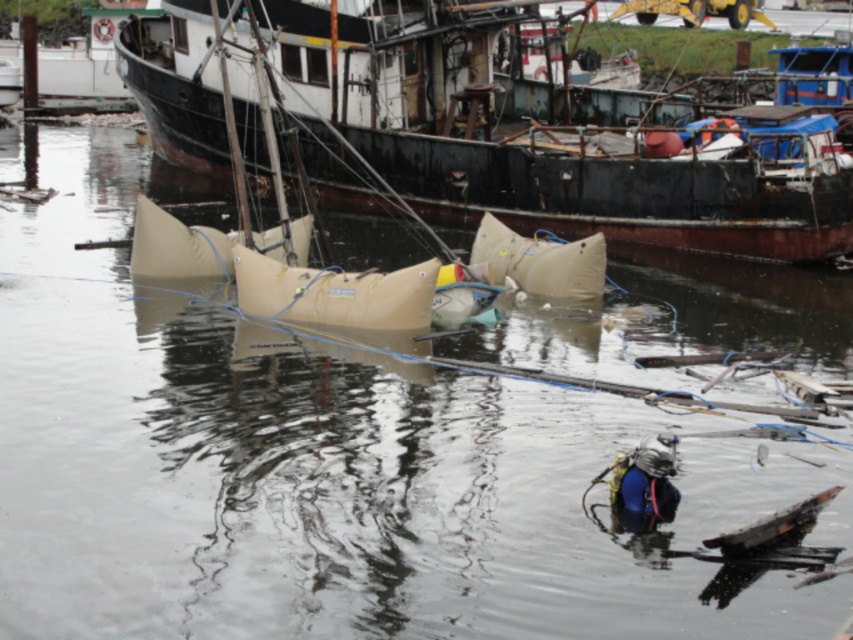
Based on the photo, you are a diver preparing to enter the water at the marina. You notice two points marked on your map corresponding to coordinates in the scene. The first point is at position point (x=332, y=164) and the second is at point (x=669, y=499). Which point is closer to you as you stand on the dock ready to dive?

Point (x=332, y=164) is closer to you because it is further to the viewer than point (x=669, y=499), meaning it is physically nearer in the scene.